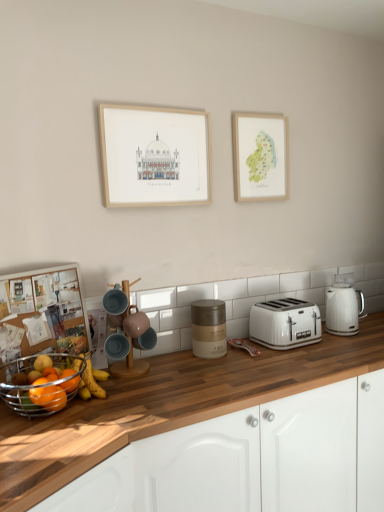
Question: From a real-world perspective, is matte ceramic mug at center, positioned as the third appliance in right-to-left order, on matte ceramic coffee machine at center?

Choices:
 (A) no
 (B) yes

Answer: (B)

Question: Is matte ceramic coffee machine at center located within matte ceramic mug at center, which is counted as the 4th appliance, starting from the back?

Choices:
 (A) no
 (B) yes

Answer: (A)

Question: Are matte ceramic mug at center, acting as the 1th appliance starting from the front, and matte ceramic coffee machine at center making contact?

Choices:
 (A) no
 (B) yes

Answer: (B)

Question: Would you say matte ceramic mug at center, which appears as the second appliance when viewed from the left, is outside matte ceramic coffee machine at center?

Choices:
 (A) yes
 (B) no

Answer: (B)

Question: Can you confirm if matte ceramic mug at center, positioned as the third appliance in right-to-left order, is smaller than matte ceramic coffee machine at center?

Choices:
 (A) yes
 (B) no

Answer: (A)

Question: Is metallic silver fruit basket at lower left taller or shorter than matte blue mug at center, the 2th appliance positioned from the front?

Choices:
 (A) tall
 (B) short

Answer: (A)

Question: From a real-world perspective, is metallic silver fruit basket at lower left above or below matte blue mug at center, the 2th appliance positioned from the front?

Choices:
 (A) below
 (B) above

Answer: (A)

Question: Looking at the image, does metallic silver fruit basket at lower left seem bigger or smaller compared to matte blue mug at center, placed as the first appliance when sorted from left to right?

Choices:
 (A) small
 (B) big

Answer: (B)

Question: Is metallic silver fruit basket at lower left wider or thinner than matte blue mug at center, placed as the first appliance when sorted from left to right?

Choices:
 (A) wide
 (B) thin

Answer: (A)

Question: In the image, is matte blue mug at center, placed as the first appliance when sorted from left to right, positioned in front of or behind white glossy electric kettle at right, which is the 4th appliance in front-to-back order?

Choices:
 (A) behind
 (B) front

Answer: (B)

Question: Considering the positions of matte blue mug at center, placed as the first appliance when sorted from left to right, and white glossy electric kettle at right, which ranks as the 1th appliance in back-to-front order, in the image, is matte blue mug at center, placed as the first appliance when sorted from left to right, bigger or smaller than white glossy electric kettle at right, which ranks as the 1th appliance in back-to-front order,?

Choices:
 (A) big
 (B) small

Answer: (B)

Question: From a real-world perspective, is matte blue mug at center, which appears as the 3th appliance when viewed from the back, physically located above or below white glossy electric kettle at right, which ranks as the 1th appliance in back-to-front order?

Choices:
 (A) below
 (B) above

Answer: (A)

Question: In terms of width, does matte blue mug at center, the 2th appliance positioned from the front, look wider or thinner when compared to white glossy electric kettle at right, the 1th appliance in the right-to-left sequence?

Choices:
 (A) thin
 (B) wide

Answer: (A)

Question: Considering the relative positions of white wood cabinetry at center and matte ceramic coffee machine at center in the image provided, is white wood cabinetry at center to the left or to the right of matte ceramic coffee machine at center?

Choices:
 (A) left
 (B) right

Answer: (B)

Question: In terms of width, does white wood cabinetry at center look wider or thinner when compared to matte ceramic coffee machine at center?

Choices:
 (A) thin
 (B) wide

Answer: (B)